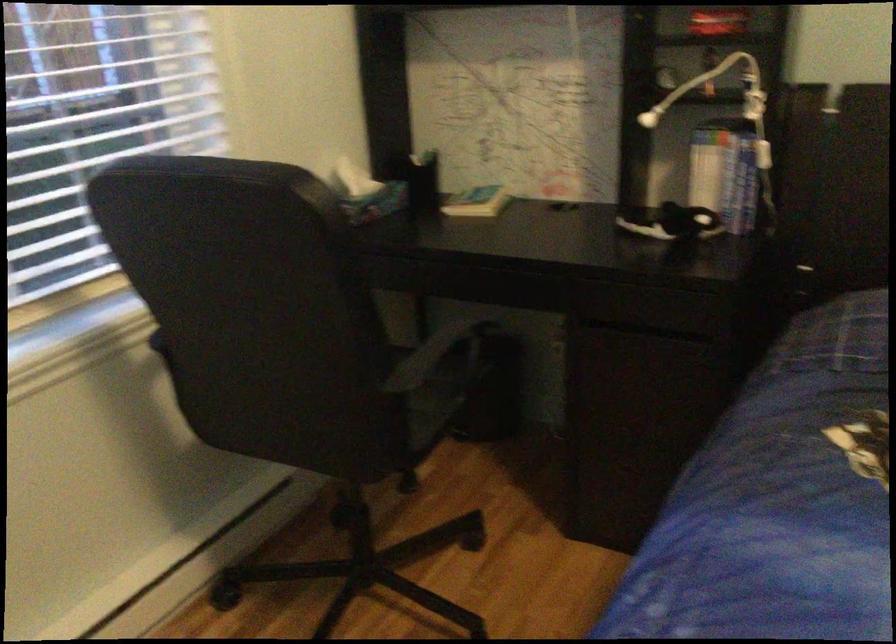
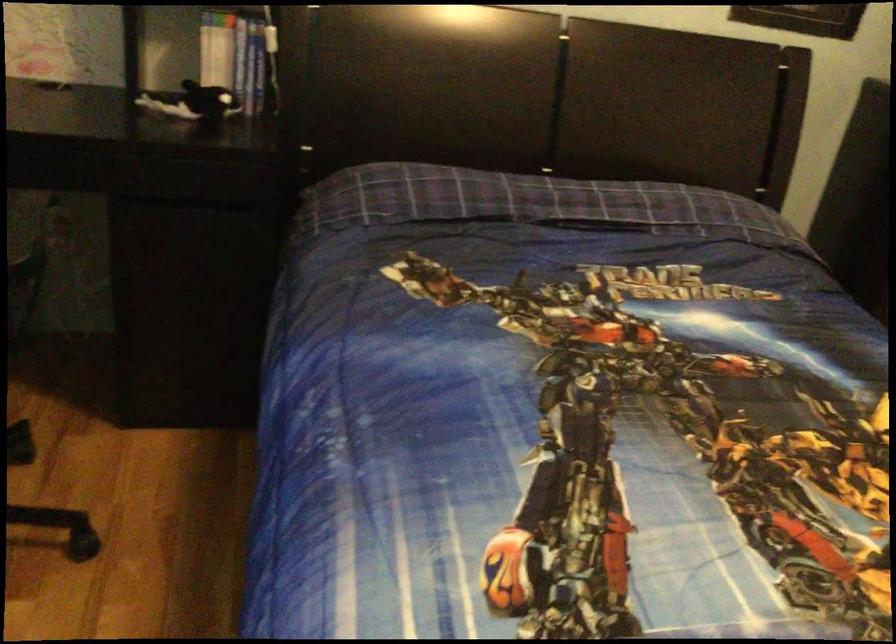
Question: The camera is either moving clockwise (left) or counter-clockwise (right) around the object. The first image is from the beginning of the video and the second image is from the end. Is the camera moving left or right when shooting the video?

Choices:
 (A) Left
 (B) Right

Answer: (A)